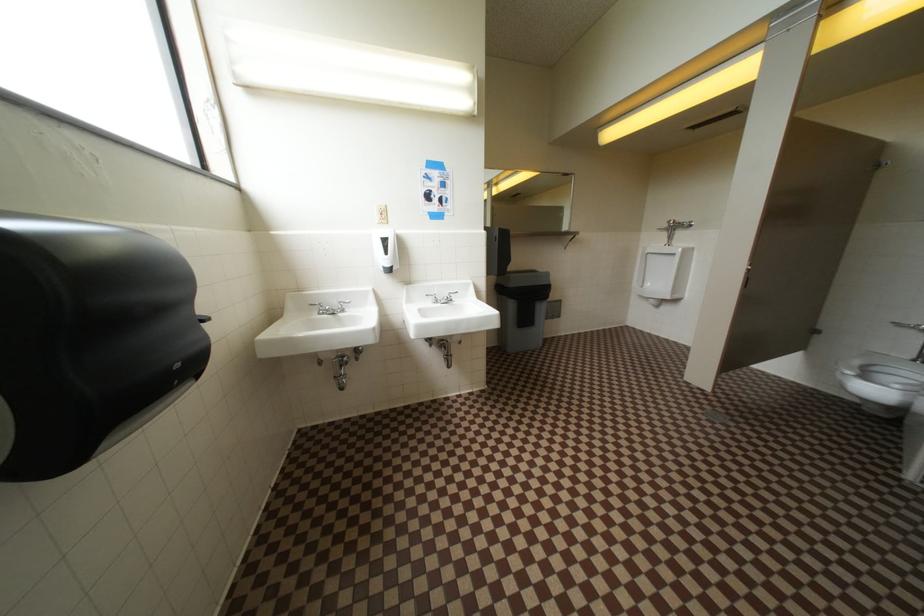
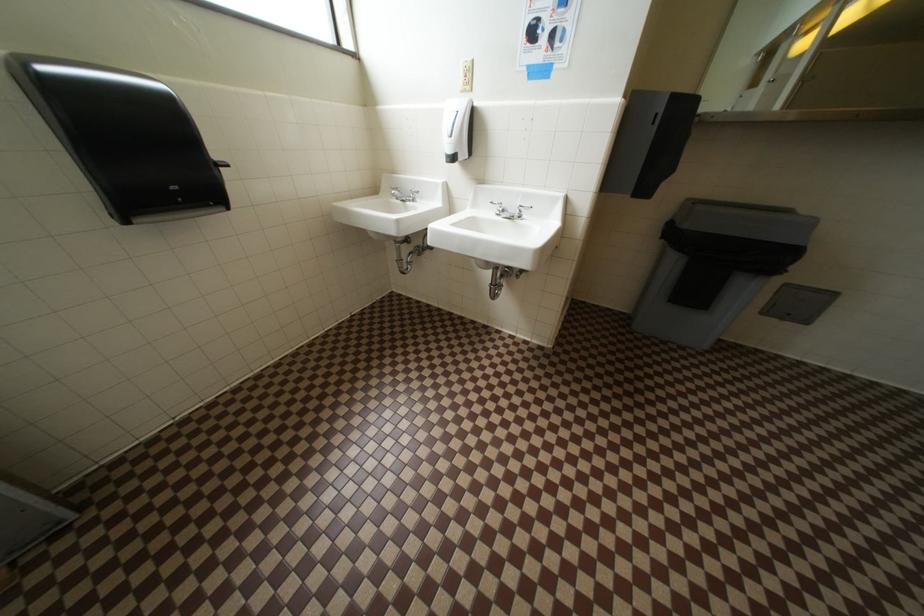
The first image is from the beginning of the video and the second image is from the end. How did the camera likely rotate when shooting the video?

The camera rotated toward left-down.